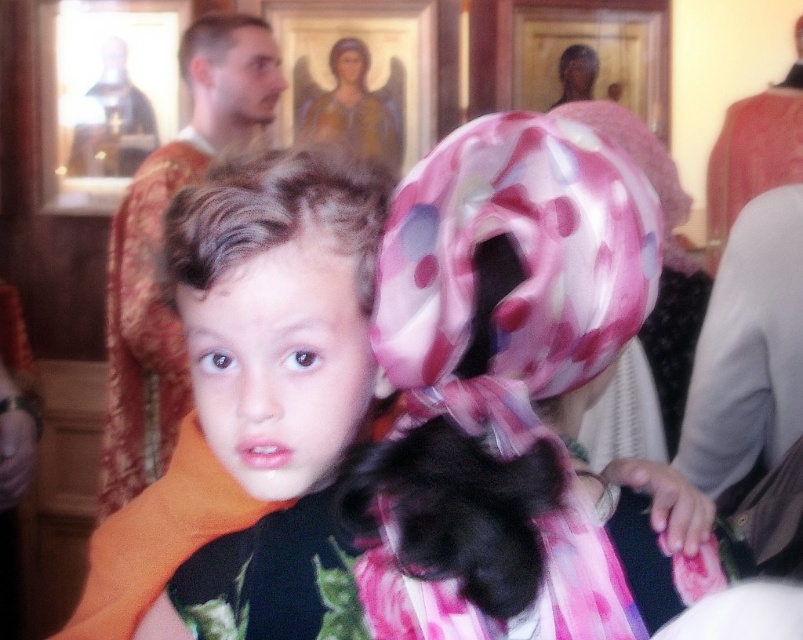
Question: Can you confirm if matte orange scarf at center is bigger than smooth skin face at upper left?

Choices:
 (A) yes
 (B) no

Answer: (B)

Question: Is pink satin headscarf at center to the left of smooth skin face at upper left from the viewer's perspective?

Choices:
 (A) yes
 (B) no

Answer: (B)

Question: Observing the image, what is the correct spatial positioning of matte orange scarf at center in reference to smooth skin face at upper left?

Choices:
 (A) right
 (B) left

Answer: (A)

Question: Which is farther from the matte orange scarf at center?

Choices:
 (A) pink satin headscarf at center
 (B) smooth skin face at upper left
 (C) orange fabric at left

Answer: (B)

Question: Which object is positioned closest to the pink satin headscarf at center?

Choices:
 (A) smooth skin face at upper left
 (B) matte orange scarf at center
 (C) orange fabric at left

Answer: (B)

Question: Which point is farther to the camera?

Choices:
 (A) smooth skin face at upper left
 (B) matte orange scarf at center
 (C) orange fabric at left

Answer: (A)